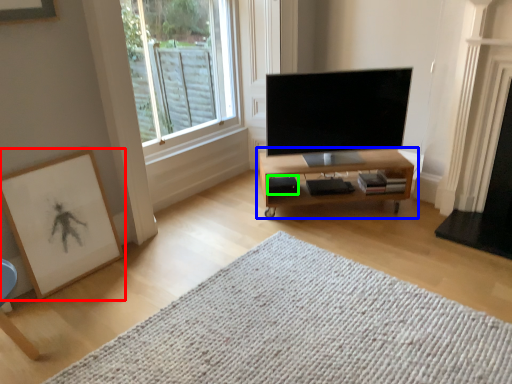
Question: Which object is the closest to the picture frame (highlighted by a red box)? Choose among these: table (highlighted by a blue box) or speaker (highlighted by a green box).

Choices:
 (A) table
 (B) speaker

Answer: (B)